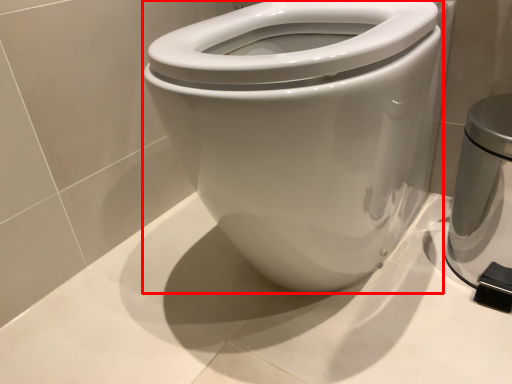
Question: From the image's perspective, what is the correct spatial relationship of bidet (annotated by the red box) in relation to appliance?

Choices:
 (A) below
 (B) above

Answer: (B)